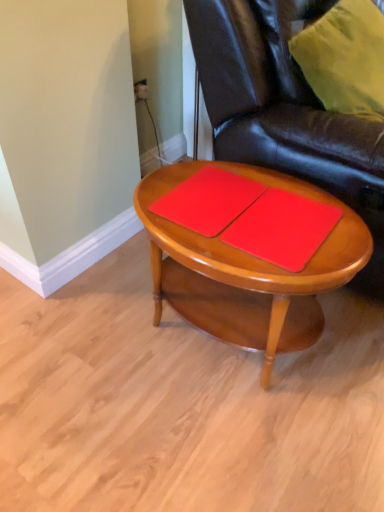
Locate an element on the screen. This screenshot has height=512, width=384. free space above matte red notebook at center, the 1th notebook from the left (from a real-world perspective) is located at coordinates (201, 192).